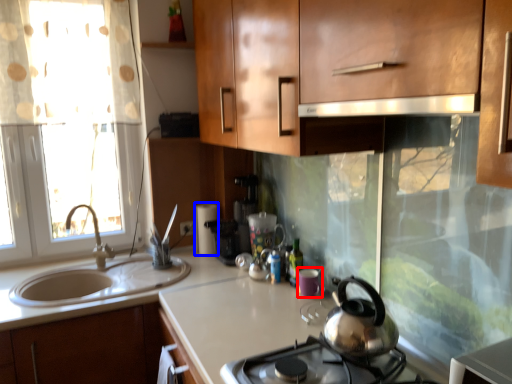
Question: Which object is closer to the camera taking this photo, appliance (highlighted by a red box) or appliance (highlighted by a blue box)?

Choices:
 (A) appliance
 (B) appliance

Answer: (A)